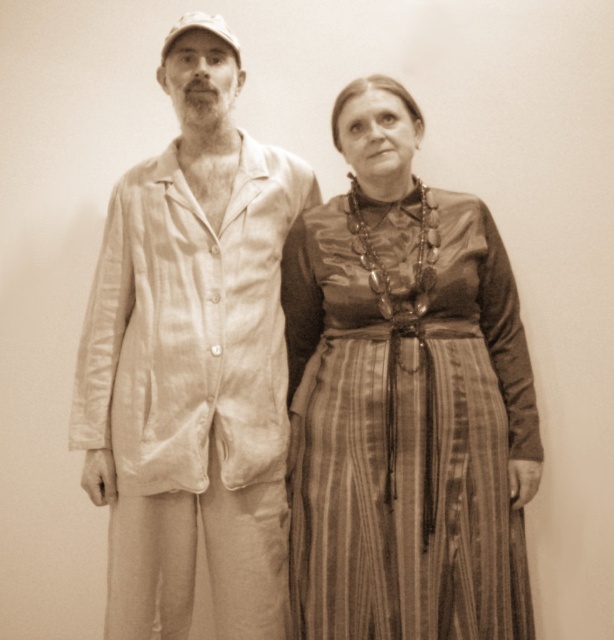
Question: In this image, where is striped silk dress at center located relative to light beige cotton pajamas at left?

Choices:
 (A) left
 (B) right

Answer: (B)

Question: Is striped silk dress at center to the right of light beige cotton pajamas at left from the viewer's perspective?

Choices:
 (A) no
 (B) yes

Answer: (B)

Question: Is striped silk dress at center wider than light beige cotton pajamas at left?

Choices:
 (A) no
 (B) yes

Answer: (B)

Question: Which point appears closest to the camera in this image?

Choices:
 (A) (141, 438)
 (B) (332, 618)

Answer: (B)